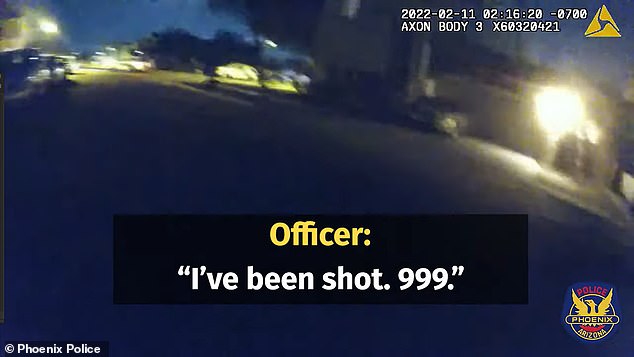
Where is `light`? This screenshot has height=357, width=634. light is located at coordinates (565, 111).